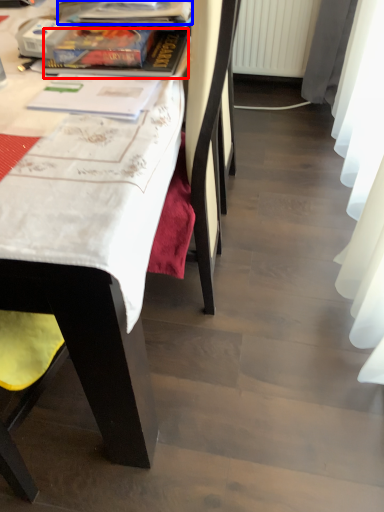
Question: Which object appears closest to the camera in this image, book (highlighted by a red box) or book (highlighted by a blue box)?

Choices:
 (A) book
 (B) book

Answer: (A)